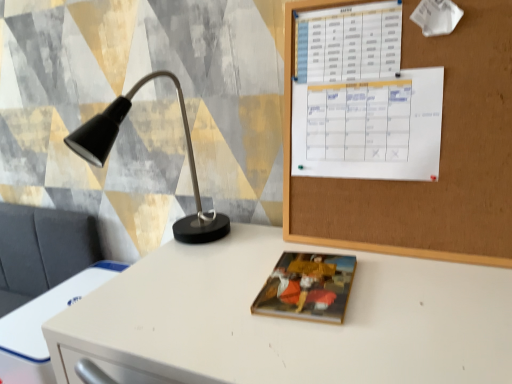
This screenshot has height=384, width=512. In order to click on free space that is to the left of matte paper book at center in this screenshot , I will do `click(214, 298)`.